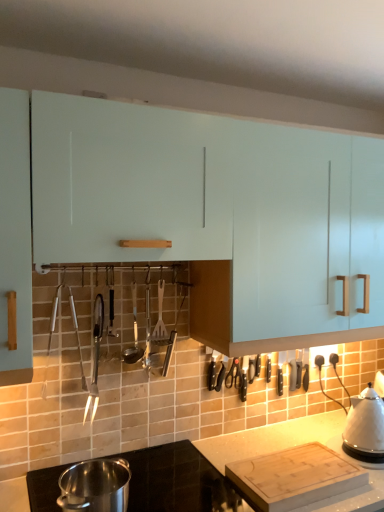
This screenshot has height=512, width=384. Find the location of `white glossy cabinet at upper center`. white glossy cabinet at upper center is located at coordinates (193, 207).

Image resolution: width=384 pixels, height=512 pixels. Describe the element at coordinates (95, 486) in the screenshot. I see `polished stainless steel pot at lower left, the second kitchen appliance viewed from the right` at that location.

The width and height of the screenshot is (384, 512). In order to click on polished stainless steel pot at lower left, which is the first kitchen appliance in left-to-right order in this screenshot , I will do `click(95, 486)`.

What is the approximate height of wooden spatula at center, positioned as the third silverware in left-to-right order?

The height of wooden spatula at center, positioned as the third silverware in left-to-right order, is 11.80 inches.

Describe the element at coordinates (160, 314) in the screenshot. I see `wooden spatula at center, positioned as the third silverware in left-to-right order` at that location.

Locate an element on the screen. polished stainless steel ladle at center, which appears as the second silverware when viewed from the left is located at coordinates (134, 333).

This screenshot has width=384, height=512. In order to click on white glossy kettle at right, the 1th kitchen appliance positioned from the back in this screenshot , I will do `click(365, 426)`.

Is polished stainless steel ladle at center, positioned as the second silverware in right-to-left order, placed right next to white glossy cabinet at upper center?

No, polished stainless steel ladle at center, positioned as the second silverware in right-to-left order, is not beside white glossy cabinet at upper center.

How many degrees apart are the facing directions of polished stainless steel ladle at center, which appears as the second silverware when viewed from the left, and white glossy cabinet at upper center?

2.49 degrees.

From the image's perspective, which is above, polished stainless steel ladle at center, which appears as the second silverware when viewed from the left, or white glossy cabinet at upper center?

white glossy cabinet at upper center, from the image's perspective.

From the picture: Which is farther, (95,353) or (358,414)?

Point (358,414)

You are a GUI agent. You are given a task and a screenshot of the screen. Output one action in this format:
    pyautogui.click(x=<x>, y=<y>)
    Task: Click on the 2nd kitchen appliance to the right of the shiny metallic tongs at center left, which is the 3th silverware in right-to-left order, counting from the anchor's position
    This screenshot has height=512, width=384.
    Given the screenshot: What is the action you would take?
    pyautogui.click(x=365, y=426)

From the image's perspective, is shiny metallic tongs at center left, arranged as the first silverware when viewed from the left, under white glossy kettle at right, the 2th kitchen appliance in the front-to-back sequence?

Incorrect, from the image's perspective, shiny metallic tongs at center left, arranged as the first silverware when viewed from the left, is higher than white glossy kettle at right, the 2th kitchen appliance in the front-to-back sequence.

Is shiny metallic tongs at center left, arranged as the first silverware when viewed from the left, facing away from white glossy kettle at right, the 2th kitchen appliance in the left-to-right sequence?

That's not correct — shiny metallic tongs at center left, arranged as the first silverware when viewed from the left, is not looking away from white glossy kettle at right, the 2th kitchen appliance in the left-to-right sequence.

Image resolution: width=384 pixels, height=512 pixels. I want to click on silverware that is the 1st one when counting leftward from the smooth white countertop at lower center, so click(x=134, y=333).

Between smooth white countertop at lower center and polished stainless steel ladle at center, positioned as the second silverware in right-to-left order, which one has larger width?

With larger width is smooth white countertop at lower center.

Does smooth white countertop at lower center appear on the left side of polished stainless steel ladle at center, positioned as the second silverware in right-to-left order?

Incorrect, smooth white countertop at lower center is not on the left side of polished stainless steel ladle at center, positioned as the second silverware in right-to-left order.

From the picture: Considering the relative sizes of smooth white countertop at lower center and polished stainless steel ladle at center, positioned as the second silverware in right-to-left order, in the image provided, is smooth white countertop at lower center bigger than polished stainless steel ladle at center, positioned as the second silverware in right-to-left order,?

Yes.

Is polished stainless steel ladle at center, positioned as the second silverware in right-to-left order, bigger than smooth white countertop at lower center?

Actually, polished stainless steel ladle at center, positioned as the second silverware in right-to-left order, might be smaller than smooth white countertop at lower center.

How many degrees apart are the facing directions of polished stainless steel ladle at center, which appears as the second silverware when viewed from the left, and smooth white countertop at lower center?

They differ by 2.51 degrees in their facing directions.

Is polished stainless steel ladle at center, positioned as the second silverware in right-to-left order, in contact with smooth white countertop at lower center?

No.

Is the position of polished stainless steel ladle at center, which appears as the second silverware when viewed from the left, less distant than that of smooth white countertop at lower center?

No, polished stainless steel ladle at center, which appears as the second silverware when viewed from the left, is behind smooth white countertop at lower center.

Is there a large distance between white glossy cabinet at upper center and white glossy kettle at right, the 2th kitchen appliance in the front-to-back sequence?

That's not correct — white glossy cabinet at upper center is a little close to white glossy kettle at right, the 2th kitchen appliance in the front-to-back sequence.

Does point (144, 114) come farther from viewer compared to point (365, 439)?

No.

You are a GUI agent. You are given a task and a screenshot of the screen. Output one action in this format:
    pyautogui.click(x=<x>, y=<y>)
    Task: Click on the cabinetry located in front of the white glossy kettle at right, the 2th kitchen appliance in the front-to-back sequence
    The width and height of the screenshot is (384, 512).
    Given the screenshot: What is the action you would take?
    click(193, 207)

Based on the photo, from a real-world perspective, is white glossy cabinet at upper center above or below white glossy kettle at right, the 2th kitchen appliance in the front-to-back sequence?

From a real-world perspective, white glossy cabinet at upper center is physically above white glossy kettle at right, the 2th kitchen appliance in the front-to-back sequence.

Is white glossy cabinet at upper center inside the boundaries of smooth white countertop at lower center, or outside?

white glossy cabinet at upper center is located beyond the bounds of smooth white countertop at lower center.

Is white glossy cabinet at upper center positioned with its back to smooth white countertop at lower center?

No, white glossy cabinet at upper center's orientation is not away from smooth white countertop at lower center.

From the picture: Are white glossy cabinet at upper center and smooth white countertop at lower center beside each other?

They are not placed beside each other.

Consider the image. Considering their positions, is white glossy cabinet at upper center located in front of or behind smooth white countertop at lower center?

white glossy cabinet at upper center is behind smooth white countertop at lower center.

Can you confirm if white glossy cabinet at upper center is shorter than shiny metallic tongs at center left, which is the 3th silverware in right-to-left order?

Incorrect, the height of white glossy cabinet at upper center does not fall short of that of shiny metallic tongs at center left, which is the 3th silverware in right-to-left order.

From the image's perspective, would you say white glossy cabinet at upper center is shown under shiny metallic tongs at center left, which is the 3th silverware in right-to-left order?

Actually, white glossy cabinet at upper center appears above shiny metallic tongs at center left, which is the 3th silverware in right-to-left order, in the image.

The width and height of the screenshot is (384, 512). In order to click on cabinetry above the polished stainless steel ladle at center, which appears as the second silverware when viewed from the left (from a real-world perspective) in this screenshot , I will do `click(193, 207)`.

The height and width of the screenshot is (512, 384). Find the location of `kitchen appliance that is the 1st object directly below the shiny metallic tongs at center left, arranged as the first silverware when viewed from the left (from a real-world perspective)`. kitchen appliance that is the 1st object directly below the shiny metallic tongs at center left, arranged as the first silverware when viewed from the left (from a real-world perspective) is located at coordinates (365, 426).

Considering their positions, is white glossy kettle at right, the 2th kitchen appliance in the front-to-back sequence, positioned closer to polished stainless steel pot at lower left, the 2th kitchen appliance when ordered from back to front, than smooth white countertop at lower center?

smooth white countertop at lower center lies closer to polished stainless steel pot at lower left, the 2th kitchen appliance when ordered from back to front, than the other object.

Estimate the real-world distances between objects in this image. Which object is closer to shiny metallic tongs at center left, arranged as the first silverware when viewed from the left, polished stainless steel ladle at center, positioned as the second silverware in right-to-left order, or polished stainless steel pot at lower left, which is the first kitchen appliance in left-to-right order?

polished stainless steel ladle at center, positioned as the second silverware in right-to-left order, is positioned closer to the anchor shiny metallic tongs at center left, arranged as the first silverware when viewed from the left.

When comparing their distances from shiny metallic tongs at center left, arranged as the first silverware when viewed from the left, does polished stainless steel pot at lower left, the second kitchen appliance viewed from the right, or smooth white countertop at lower center seem further?

smooth white countertop at lower center.

Looking at this image, considering their positions, is smooth white countertop at lower center positioned further to polished stainless steel pot at lower left, which is counted as the first kitchen appliance, starting from the front, than white glossy kettle at right, the 2th kitchen appliance in the front-to-back sequence?

Among the two, white glossy kettle at right, the 2th kitchen appliance in the front-to-back sequence, is located further to polished stainless steel pot at lower left, which is counted as the first kitchen appliance, starting from the front.

When comparing their distances from polished stainless steel pot at lower left, the second kitchen appliance viewed from the right, does polished stainless steel ladle at center, which appears as the second silverware when viewed from the left, or shiny metallic tongs at center left, arranged as the first silverware when viewed from the left, seem closer?

The object closer to polished stainless steel pot at lower left, the second kitchen appliance viewed from the right, is shiny metallic tongs at center left, arranged as the first silverware when viewed from the left.

Looking at the image, which one is located further to polished stainless steel pot at lower left, which is counted as the first kitchen appliance, starting from the front, polished stainless steel ladle at center, which appears as the second silverware when viewed from the left, or white glossy kettle at right, the 1th kitchen appliance positioned from the back?

Among the two, white glossy kettle at right, the 1th kitchen appliance positioned from the back, is located further to polished stainless steel pot at lower left, which is counted as the first kitchen appliance, starting from the front.

Based on their spatial positions, is white glossy kettle at right, which appears as the first kitchen appliance when viewed from the right, or wooden spatula at center, positioned as the third silverware in left-to-right order, closer to white glossy cabinet at upper center?

wooden spatula at center, positioned as the third silverware in left-to-right order.

When comparing their distances from smooth white countertop at lower center, does shiny metallic tongs at center left, which is the 3th silverware in right-to-left order, or polished stainless steel pot at lower left, the 2th kitchen appliance when ordered from back to front, seem further?

Based on the image, shiny metallic tongs at center left, which is the 3th silverware in right-to-left order, appears to be further to smooth white countertop at lower center.

Find the location of a particular element. The image size is (384, 512). countertop between shiny metallic tongs at center left, arranged as the first silverware when viewed from the left, and white glossy kettle at right, the 2th kitchen appliance in the left-to-right sequence, in the horizontal direction is located at coordinates (177, 481).

The image size is (384, 512). I want to click on silverware located between smooth white countertop at lower center and white glossy kettle at right, the 2th kitchen appliance in the front-to-back sequence, in the left-right direction, so click(160, 314).

The width and height of the screenshot is (384, 512). I want to click on silverware located between polished stainless steel ladle at center, positioned as the second silverware in right-to-left order, and white glossy kettle at right, the 2th kitchen appliance in the left-to-right sequence, in the left-right direction, so click(160, 314).

Find the location of a particular element. This screenshot has height=512, width=384. kitchen appliance positioned between smooth white countertop at lower center and shiny metallic tongs at center left, which is the 3th silverware in right-to-left order, from near to far is located at coordinates (95, 486).